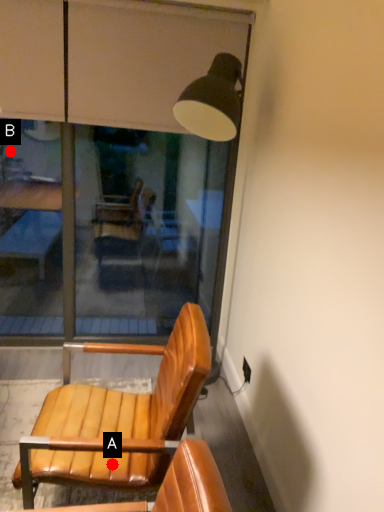
Question: Two points are circled on the image, labeled by A and B beside each circle. Which point is farther to the camera?

Choices:
 (A) A is further
 (B) B is further

Answer: (B)